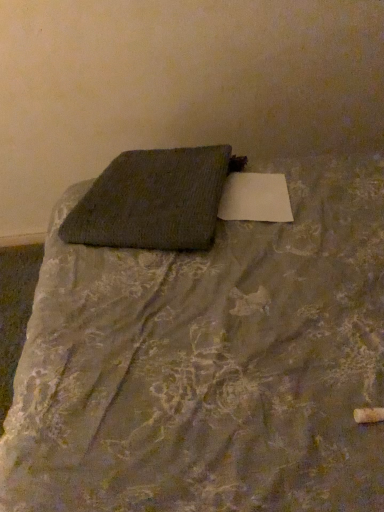
Question: From the image's perspective, does textured gray fabric at center appear lower than textured gray pillow at center?

Choices:
 (A) no
 (B) yes

Answer: (B)

Question: Considering the relative sizes of textured gray fabric at center and textured gray pillow at center in the image provided, is textured gray fabric at center thinner than textured gray pillow at center?

Choices:
 (A) no
 (B) yes

Answer: (A)

Question: Is textured gray pillow at center surrounded by textured gray fabric at center?

Choices:
 (A) no
 (B) yes

Answer: (B)

Question: Does textured gray fabric at center have a lesser height compared to textured gray pillow at center?

Choices:
 (A) no
 (B) yes

Answer: (A)

Question: Is textured gray fabric at center looking in the opposite direction of textured gray pillow at center?

Choices:
 (A) yes
 (B) no

Answer: (B)

Question: Is textured gray fabric at center oriented towards textured gray pillow at center?

Choices:
 (A) yes
 (B) no

Answer: (A)

Question: Is textured gray pillow at center far from textured gray fabric at center?

Choices:
 (A) no
 (B) yes

Answer: (A)

Question: Considering the relative positions of textured gray pillow at center and textured gray fabric at center in the image provided, is textured gray pillow at center to the left of textured gray fabric at center from the viewer's perspective?

Choices:
 (A) no
 (B) yes

Answer: (B)

Question: Can you confirm if textured gray pillow at center is positioned to the right of textured gray fabric at center?

Choices:
 (A) yes
 (B) no

Answer: (B)

Question: Is textured gray pillow at center next to textured gray fabric at center and touching it?

Choices:
 (A) yes
 (B) no

Answer: (B)

Question: Is textured gray pillow at center turned away from textured gray fabric at center?

Choices:
 (A) yes
 (B) no

Answer: (A)

Question: Can you confirm if textured gray pillow at center is smaller than textured gray fabric at center?

Choices:
 (A) no
 (B) yes

Answer: (B)

Question: From a real-world perspective, is textured gray pillow at center above or below textured gray fabric at center?

Choices:
 (A) below
 (B) above

Answer: (B)